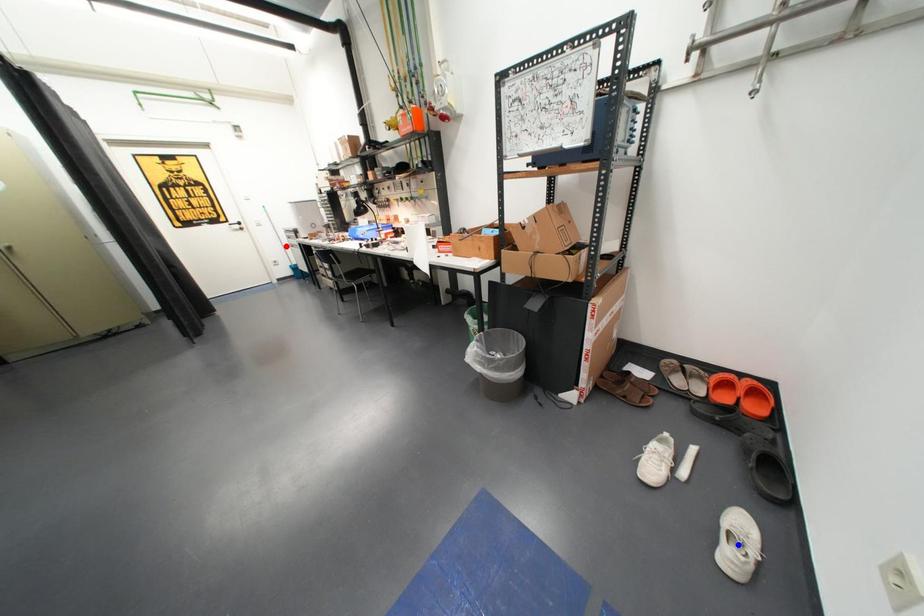
Question: In the image, two points are highlighted. Which point is nearer to the camera? Reply with the corresponding letter.

Choices:
 (A) blue point
 (B) red point

Answer: (A)